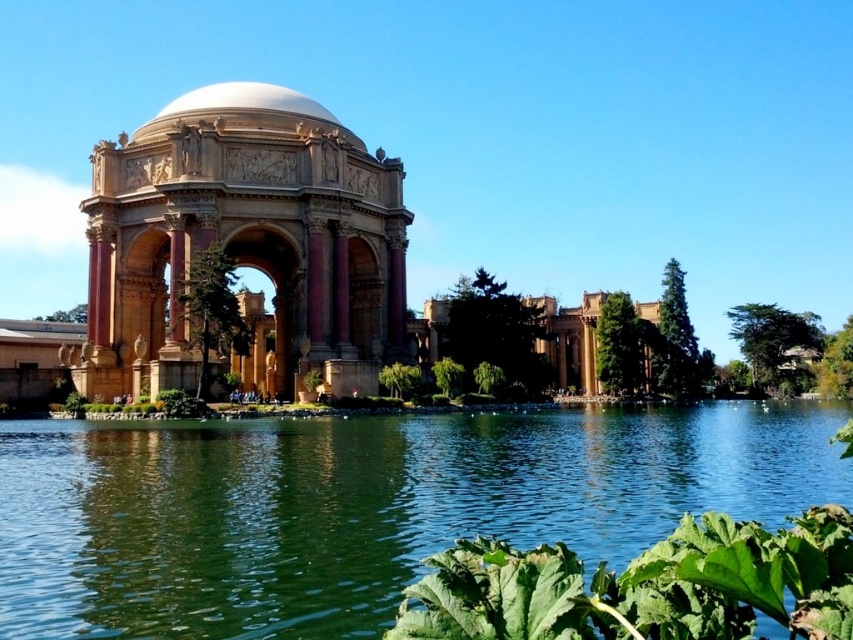
You are planning to place a large statue that requires a base 1.5 meters wide. You have two options for placement locations in the scene described. The first option is the golden stone gazebo at center, and the second option is the white marble dome at upper center. Based on their widths, which location can accommodate the statue?

The white marble dome at upper center has a greater width than the golden stone gazebo at center. Since the statue requires a base of 1.5 meters, the white marble dome at upper center is the better option as it can accommodate the statue due to its larger width.

You are standing in front of the Palace of Fine Arts. There is a point marked at coordinates (363,506). What is located at that point?

The point at coordinates (363,506) corresponds to green liquid water at center.